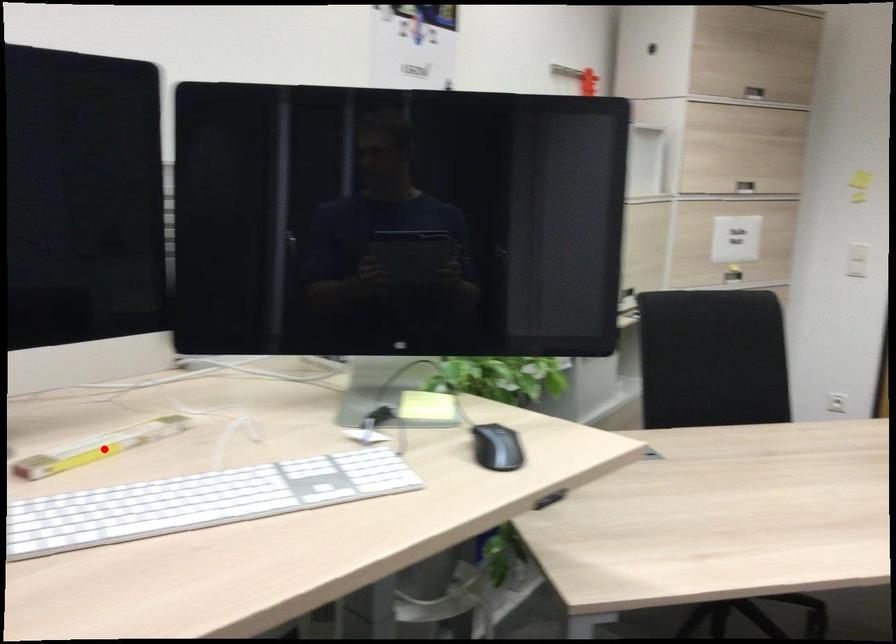
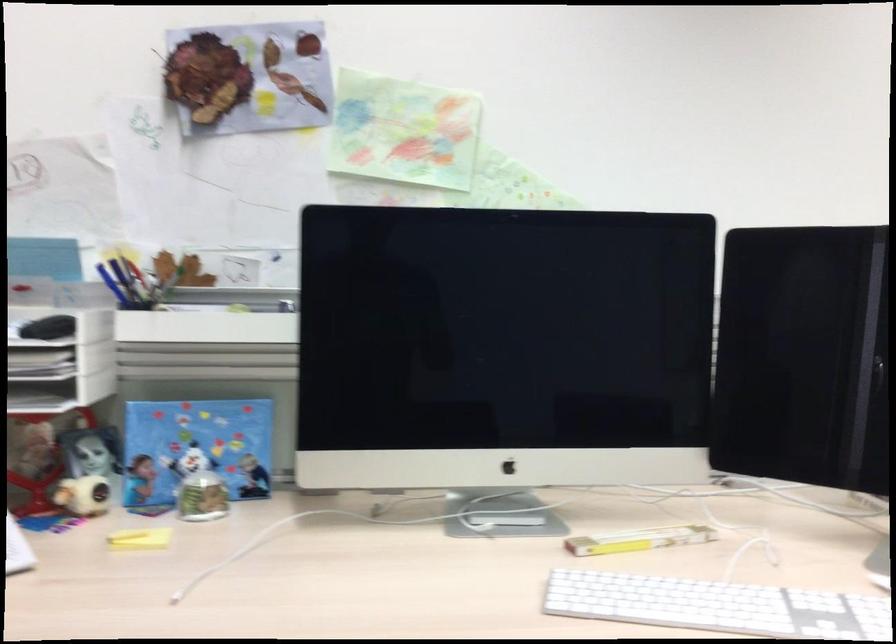
Find the pixel in the second image that matches the highlighted location in the first image.

(638, 540)